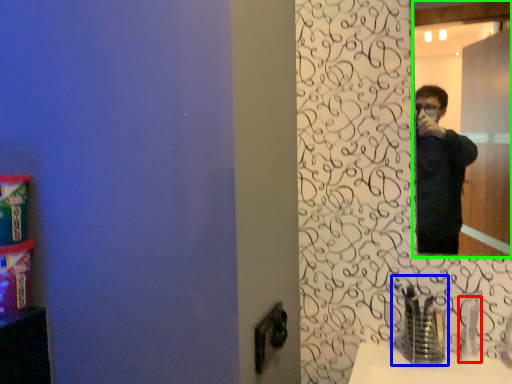
Question: Based on their relative distances, which object is farther from faucet (highlighted by a red box)? Choose from faucet (highlighted by a blue box) and mirror (highlighted by a green box).

Choices:
 (A) faucet
 (B) mirror

Answer: (B)